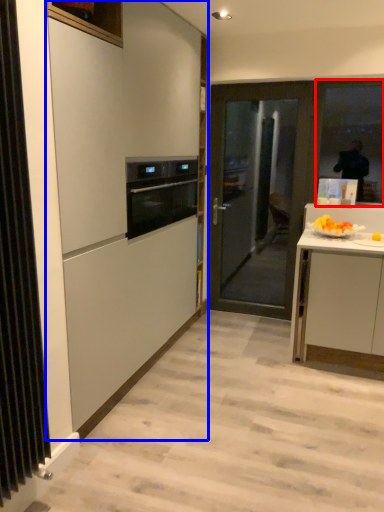
Question: Which object appears closest to the camera in this image, window (highlighted by a red box) or cabinetry (highlighted by a blue box)?

Choices:
 (A) window
 (B) cabinetry

Answer: (B)